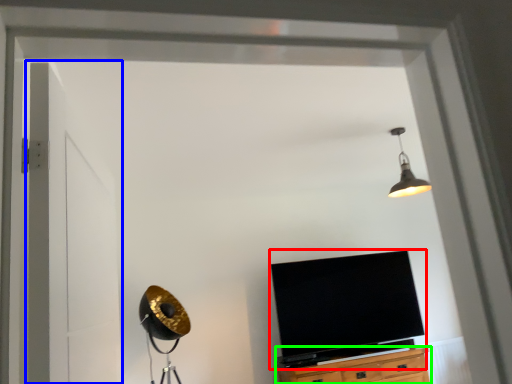
Question: Which is farther away from television (highlighted by a red box)? door (highlighted by a blue box) or cabinetry (highlighted by a green box)?

Choices:
 (A) door
 (B) cabinetry

Answer: (A)